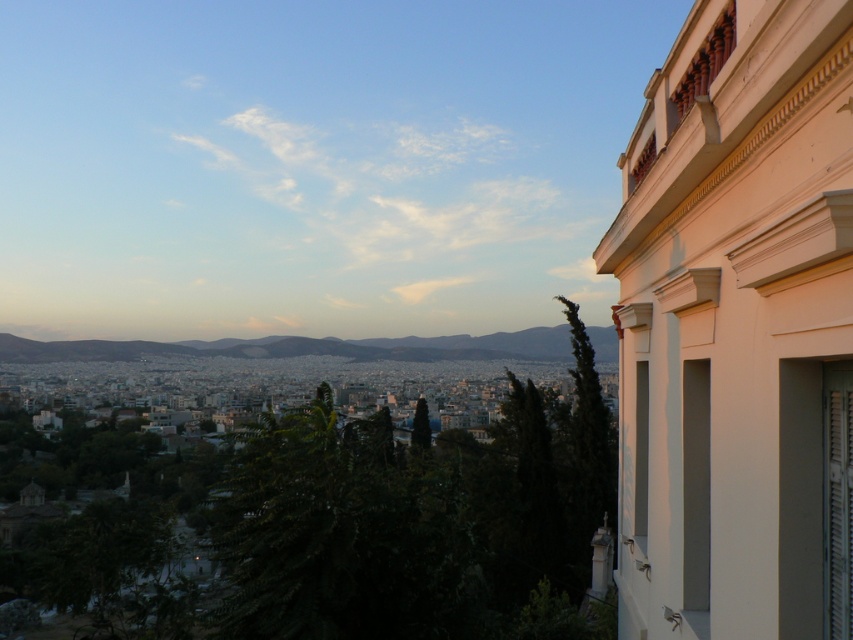
You are standing on the green grassy hill at center and want to reach the white painted wood balcony at upper right. Which direction should you move to get there?

The white painted wood balcony at upper right is positioned over the green grassy hill at center, so you should move towards the upper right direction to reach it.

You are standing in the cityscape scene and want to determine which of the two points, point (674, 406) or point (96, 360), is nearer to your current position. Based on the scene description, which point is closer to you?

Point (674, 406) is closer to the camera than point (96, 360), so it is nearer to your current position.